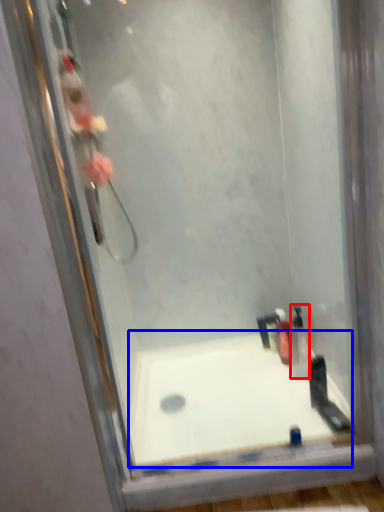
Question: Which point is closer to the camera, toiletry (highlighted by a red box) or bathtub (highlighted by a blue box)?

Choices:
 (A) toiletry
 (B) bathtub

Answer: (B)